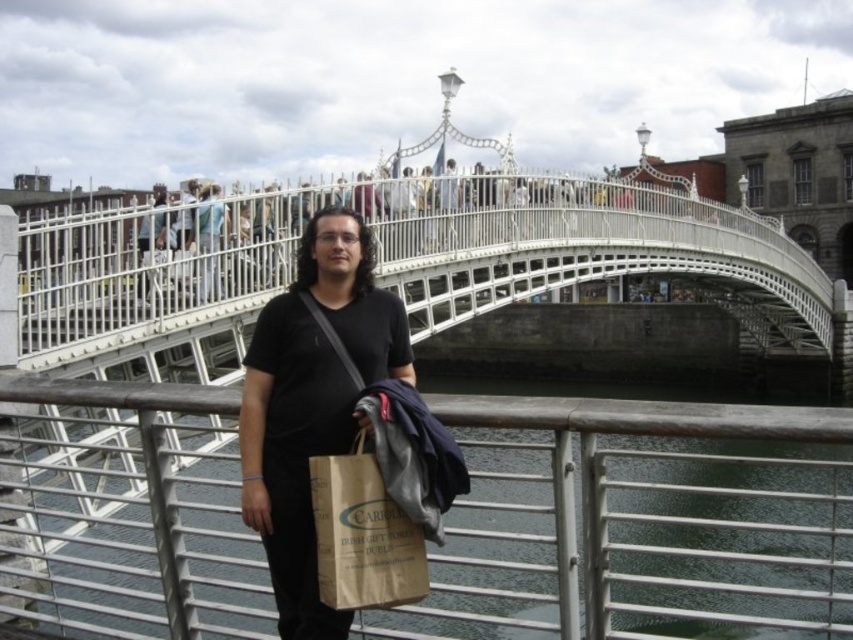
You are standing on the Haapenny Bridge in Dublin and see two points marked on the bridge. The first point is at coordinates point (805, 502) and the second is at point (210, 225). Which point is closer to you?

Point (805, 502) is closer to you because it is further to the viewer than point (210, 225).